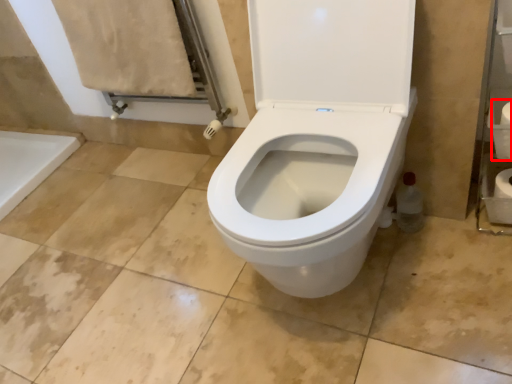
Question: From the image's perspective, considering the relative positions of toilet paper (annotated by the red box) and toilet paper in the image provided, where is toilet paper (annotated by the red box) located with respect to the staircase?

Choices:
 (A) above
 (B) below

Answer: (A)